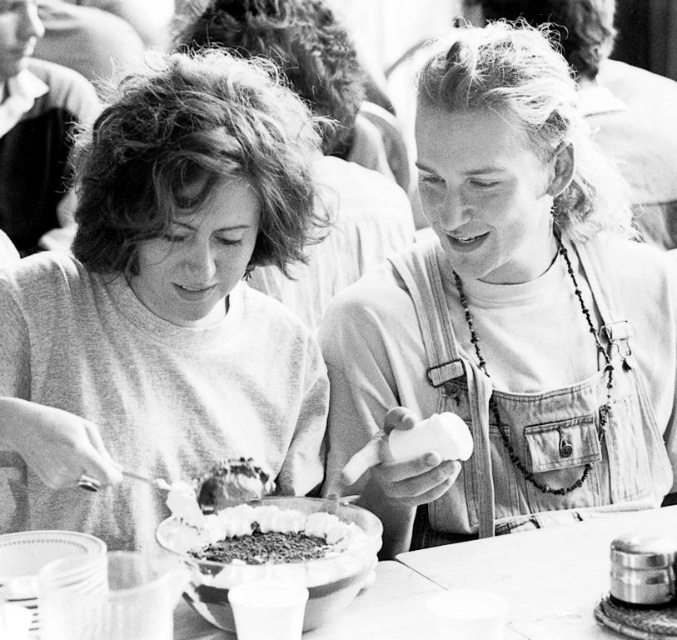
You are a photographer adjusting the lighting for a food photography shoot. You have a denim overalls at center and a crumbly chocolate cake at center in the frame. Which object should you focus on if you want to highlight the smaller item in the scene?

The crumbly chocolate cake at center is smaller than the denim overalls at center, so you should focus on the crumbly chocolate cake at center to highlight the smaller item.

From the picture: You are a chef preparing to place a new dish on the table. Given the dimensions of the smooth wooden table at center and the denim overalls at center, can you determine if there is enough space to place the dish without it overlapping with the denim overalls?

The denim overalls at center has a lesser width compared to the smooth wooden table at center, so there should be enough space to place the dish on the smooth wooden table at center without overlapping with the denim overalls.

You are standing at the point marked by the coordinates (462, 369) in the image. You want to reach the door located 1.70 meters away from you. Can you walk straight to it without any obstacles?

Yes, since the point marked by the coordinates (462, 369) and the viewer are 1.70 meters apart, you can walk straight to the door located at that distance without any obstacles.